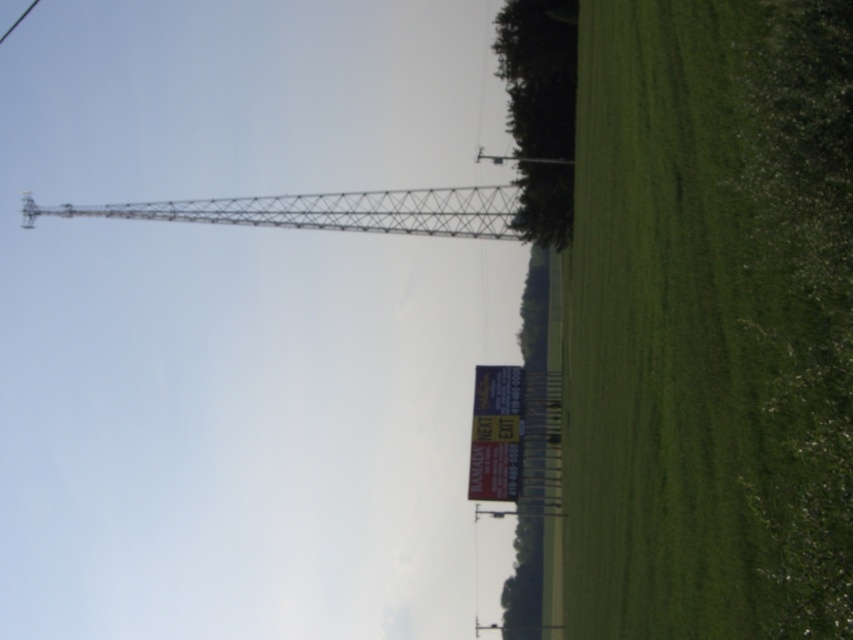
Question: Is metallic lattice tower at upper center to the left of metallic sign at center from the viewer's perspective?

Choices:
 (A) no
 (B) yes

Answer: (B)

Question: Estimate the real-world distances between objects in this image. Which object is farther from the metallic sign at center?

Choices:
 (A) metallic lattice tower at upper center
 (B) green grass hedge at right

Answer: (B)

Question: Does green grass at lower right have a smaller size compared to metallic sign at center?

Choices:
 (A) no
 (B) yes

Answer: (A)

Question: Is green grass at lower right closer to the viewer compared to green grass hedge at right?

Choices:
 (A) no
 (B) yes

Answer: (A)

Question: Estimate the real-world distances between objects in this image. Which object is closer to the green grass hedge at right?

Choices:
 (A) green grass at lower right
 (B) metallic lattice tower at upper center
 (C) metallic sign at center

Answer: (A)

Question: Which object is closer to the camera taking this photo?

Choices:
 (A) green grass hedge at right
 (B) metallic sign at center

Answer: (A)